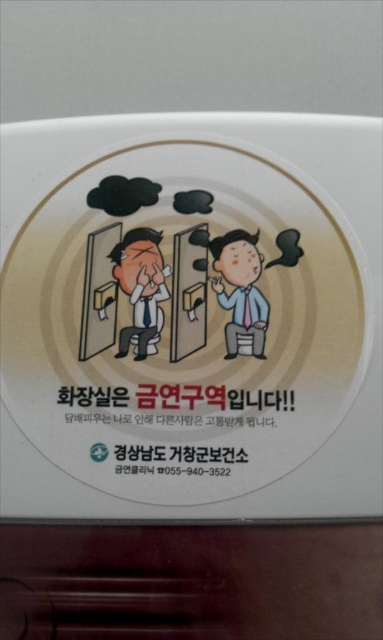
Question: Does white glossy plate at center have a greater width compared to matte black man at left?

Choices:
 (A) no
 (B) yes

Answer: (B)

Question: Does black paper text at center have a smaller size compared to matte black man at center?

Choices:
 (A) no
 (B) yes

Answer: (A)

Question: Which of the following is the farthest from the observer?

Choices:
 (A) matte black man at center
 (B) white glossy plate at center

Answer: (A)

Question: Which of the following is the farthest from the observer?

Choices:
 (A) (139, 246)
 (B) (268, 420)

Answer: (A)

Question: Among these points, which one is farthest from the camera?

Choices:
 (A) (229, 337)
 (B) (16, 192)

Answer: (B)

Question: Is black paper text at center wider than matte black man at left?

Choices:
 (A) no
 (B) yes

Answer: (B)